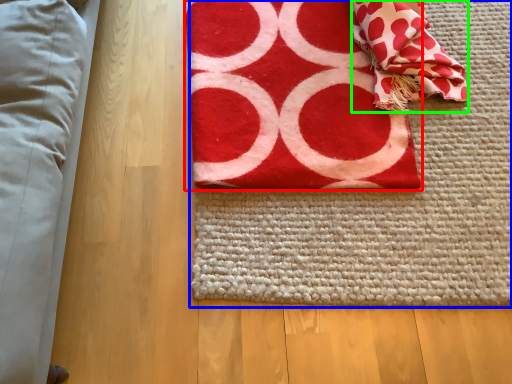
Question: Which object is positioned farthest from towel (highlighted by a red box)? Select from yoga mat (highlighted by a blue box) and blanket (highlighted by a green box).

Choices:
 (A) yoga mat
 (B) blanket

Answer: (B)